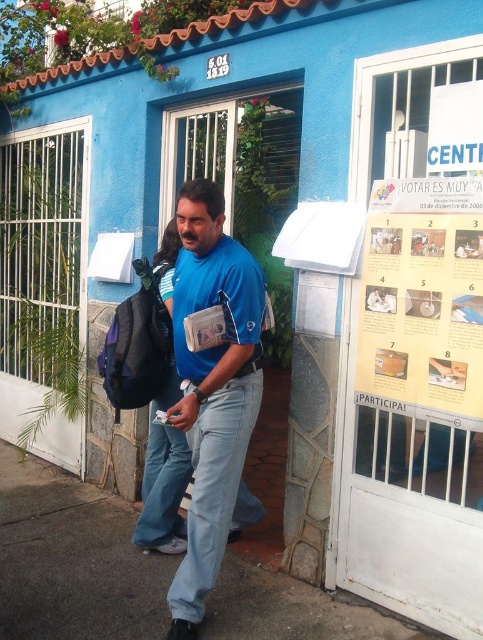
You are standing at the entrance of the building with the blue facade. You need to place a large potted plant that takes up the same space as the gray concrete pavement at lower center. Will the blue cotton shirt at center be able to move freely around it?

The gray concrete pavement at lower center has a larger size compared to blue cotton shirt at center. Since the potted plant would occupy the same space as the gray concrete pavement at lower center, the blue cotton shirt at center may have limited space to move freely around it due to the large size of the plant.

Consider the image. You are standing in front of the building with the blue facade and need to reach a point closer to you. Which of the two points, point (8, 593) or point (370, 340), should you head towards?

Point (8, 593) is closer to the viewer, so you should head towards point (8, 593).

You are standing in front of the building and see the yellow paper poster at upper right and the blue cotton shirt at center. Which object is closer to you?

The yellow paper poster at upper right is closer to you because it is in front of the blue cotton shirt at center.